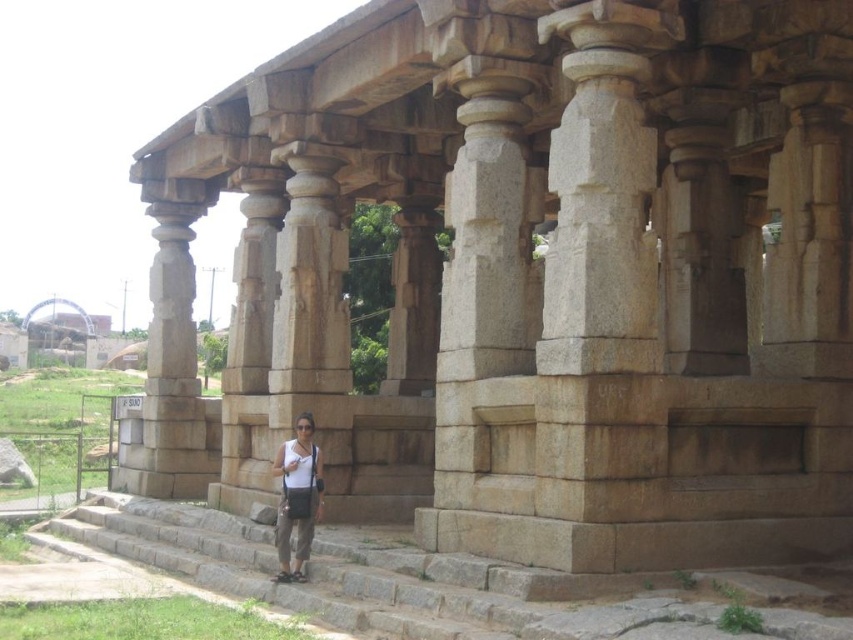
Between brown stone stairs at center and matte white shirt at center, which one has less height?

Standing shorter between the two is brown stone stairs at center.

Is brown stone stairs at center wider than matte white shirt at center?

Yes, brown stone stairs at center is wider than matte white shirt at center.

The width and height of the screenshot is (853, 640). Describe the element at coordinates (410, 582) in the screenshot. I see `brown stone stairs at center` at that location.

The image size is (853, 640). I want to click on brown stone stairs at center, so click(410, 582).